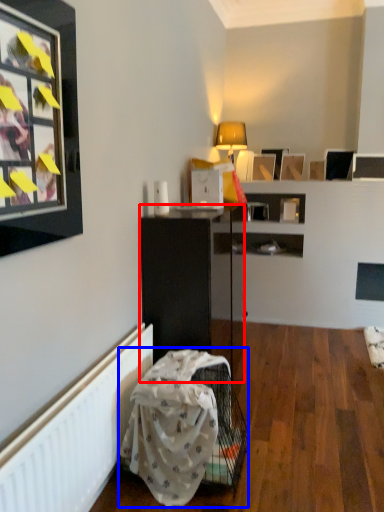
Question: Which object is further to the camera taking this photo, shelf (highlighted by a red box) or swivel chair (highlighted by a blue box)?

Choices:
 (A) shelf
 (B) swivel chair

Answer: (A)